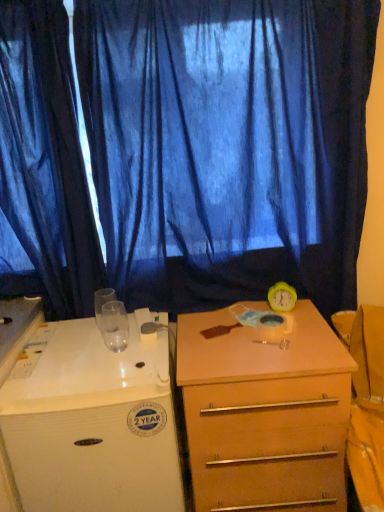
Find the location of a particular element. The image size is (384, 512). vacant space situated above white glossy desk at left (from a real-world perspective) is located at coordinates (85, 351).